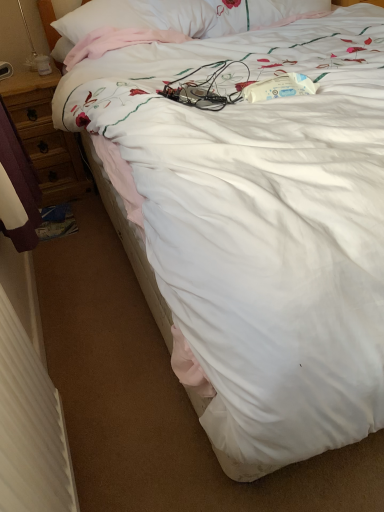
You are a GUI agent. You are given a task and a screenshot of the screen. Output one action in this format:
    pyautogui.click(x=<x>, y=<y>)
    Task: Click on the free spot above wooden desk at left (from a real-world perspective)
    The image size is (384, 512).
    Given the screenshot: What is the action you would take?
    pyautogui.click(x=25, y=73)